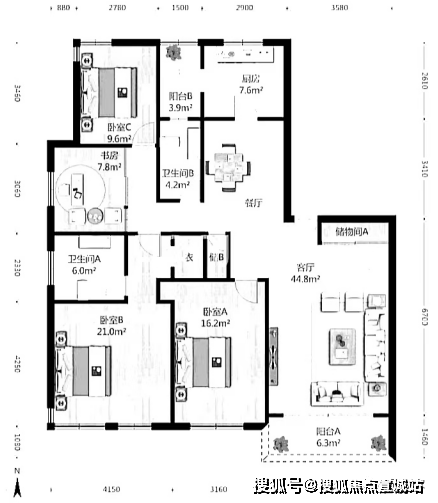
Where is `tv`? This screenshot has width=438, height=503. tv is located at coordinates (275, 357).